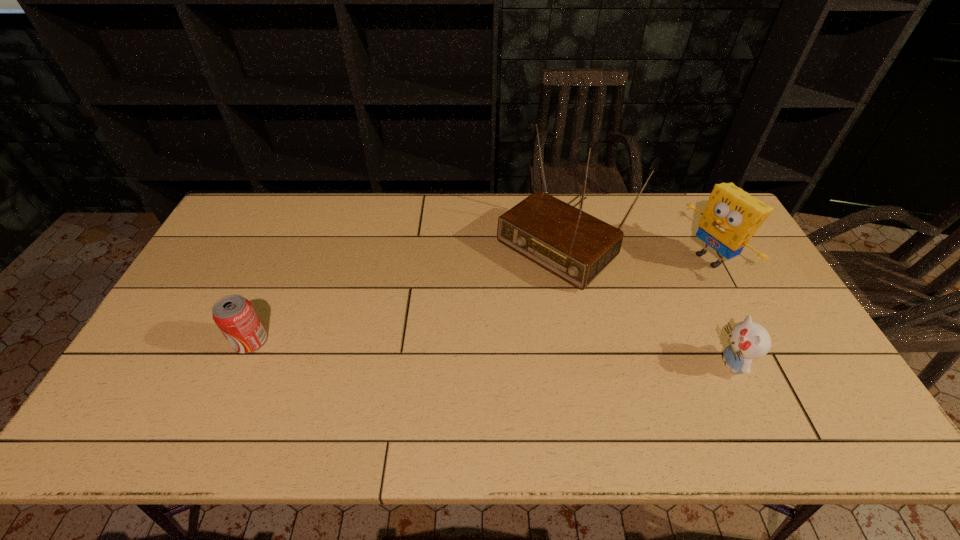
Identify the location of vacant space at the far edge of the desktop. (513, 204).

Locate an element on the screen. free space at the near edge of the desktop is located at coordinates (558, 386).

Locate an element on the screen. vacant space at the left edge of the desktop is located at coordinates (142, 359).

Identify the location of free space at the right edge of the desktop. (736, 312).

The image size is (960, 540). I want to click on vacant space at the far left corner, so click(x=226, y=230).

I want to click on vacant space at the far right corner of the desktop, so click(x=686, y=201).

What are the coordinates of `free region at the near right corner of the desktop` in the screenshot? It's located at (780, 374).

The height and width of the screenshot is (540, 960). In order to click on free spot between the third object from right to left and the kitten in this screenshot , I will do `click(645, 301)`.

Locate an element on the screen. vacant space that's between the kitten and the leftmost object is located at coordinates (492, 352).

Image resolution: width=960 pixels, height=540 pixels. In order to click on free space between the radio_receiver and the kitten in this screenshot , I will do `click(645, 301)`.